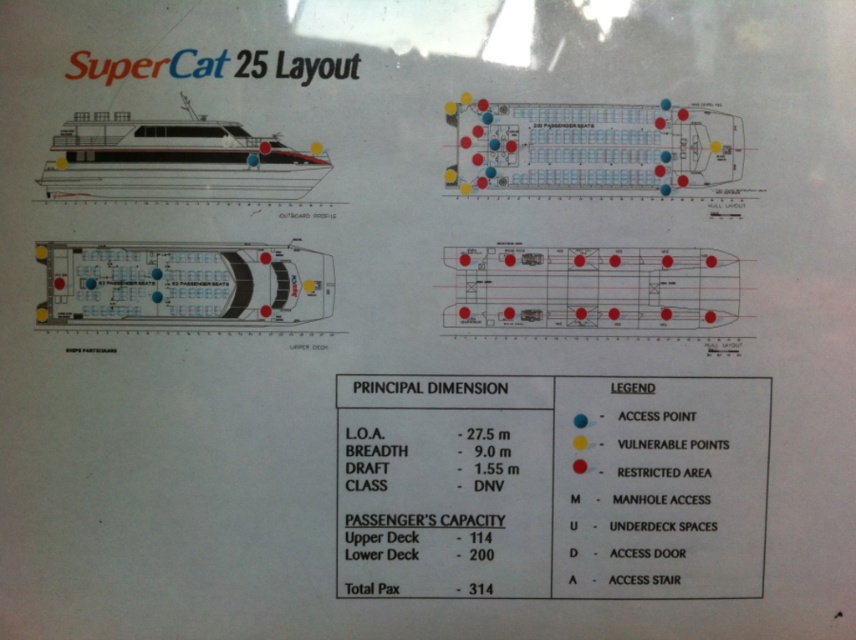
You are a passenger on the SuperCat 25 and need to locate the white plastic boat at center and the white glossy ship at upper left. From your current position at the entrance, which direction should you move to reach both objects first?

The white plastic boat at center is to the left of the white glossy ship at upper left. Since you are at the entrance, moving left would allow you to reach the white plastic boat at center first before the white glossy ship at upper left.

You are a passenger on the SuperCat 25 ferry and want to locate the white plastic boat at center and the white glossy ship at upper left. Based on the diagram, which one is closer to you from your current position at the access points marked by blue dots?

The white plastic boat at center is closer to you because it is further to the viewer than the white glossy ship at upper left, meaning it is positioned nearer in the diagram.